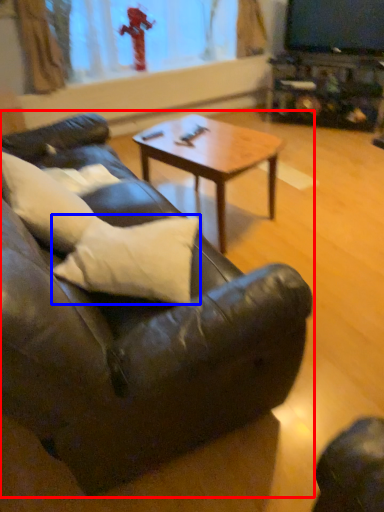
Question: Which of the following is the farthest to the observer, studio couch (highlighted by a red box) or pillow (highlighted by a blue box)?

Choices:
 (A) studio couch
 (B) pillow

Answer: (B)